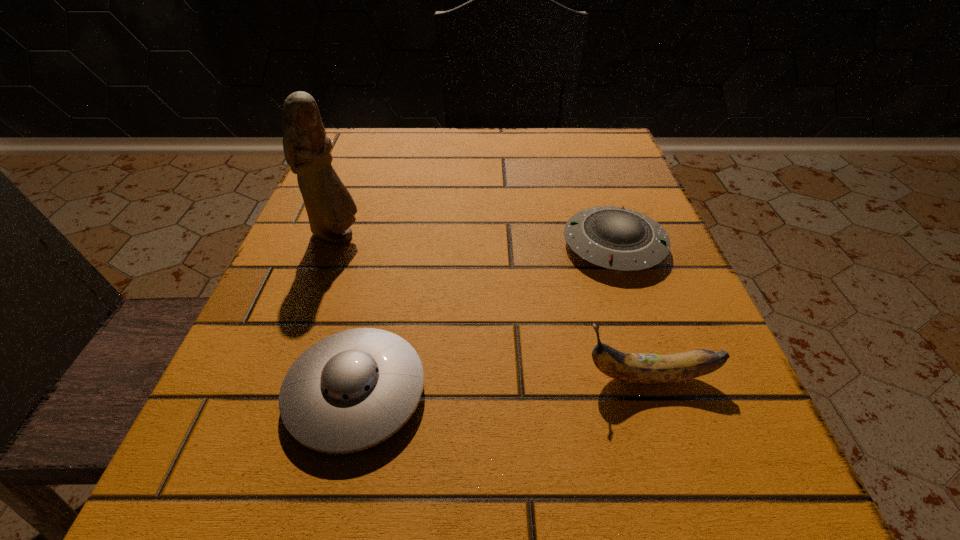
This screenshot has width=960, height=540. What are the coordinates of `the tallest object` in the screenshot? It's located at (330, 207).

At what (x,y) coordinates should I click in order to perform the action: click on banana. Please return your answer as a coordinate pair (x, y). Looking at the image, I should click on (634, 368).

Locate an element on the screen. Image resolution: width=960 pixels, height=540 pixels. the third tallest object is located at coordinates (352, 390).

What are the coordinates of `the nearer saucer` in the screenshot? It's located at (352, 390).

The width and height of the screenshot is (960, 540). Find the location of `the shorter saucer`. the shorter saucer is located at coordinates (616, 238).

You are a GUI agent. You are given a task and a screenshot of the screen. Output one action in this format:
    pyautogui.click(x=<x>, y=<y>)
    Task: Click on the farther saucer
    
    Given the screenshot: What is the action you would take?
    pyautogui.click(x=616, y=238)

The image size is (960, 540). What are the coordinates of `free location located on the front-facing side of the figurine` in the screenshot? It's located at (447, 236).

This screenshot has height=540, width=960. I want to click on vacant space positioned on the peel of the banana, so click(x=519, y=377).

Identify the location of vacant space located on the peel of the banana. The height and width of the screenshot is (540, 960). (319, 377).

You are a GUI agent. You are given a task and a screenshot of the screen. Output one action in this format:
    pyautogui.click(x=<x>, y=<y>)
    Task: Click on the blank space located on the peel of the banana
    The image size is (960, 540).
    Given the screenshot: What is the action you would take?
    pyautogui.click(x=279, y=377)